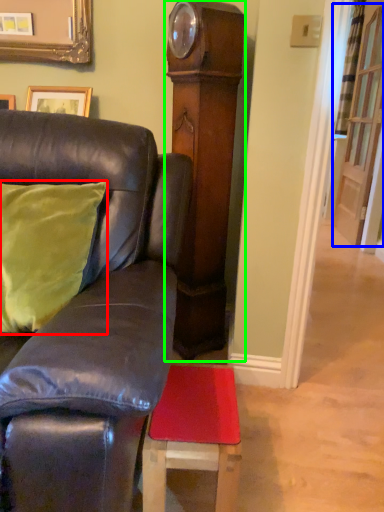
Question: Considering the real-world distances, which object is farthest from pillow (highlighted by a red box)? glass door (highlighted by a blue box) or side (highlighted by a green box)?

Choices:
 (A) glass door
 (B) side

Answer: (A)